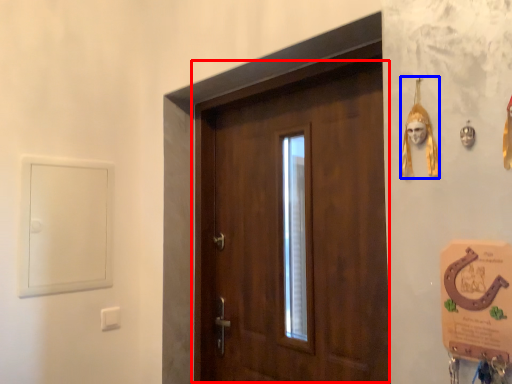
Question: Which object is closer to the camera taking this photo, door (highlighted by a red box) or decor (highlighted by a blue box)?

Choices:
 (A) door
 (B) decor

Answer: (B)